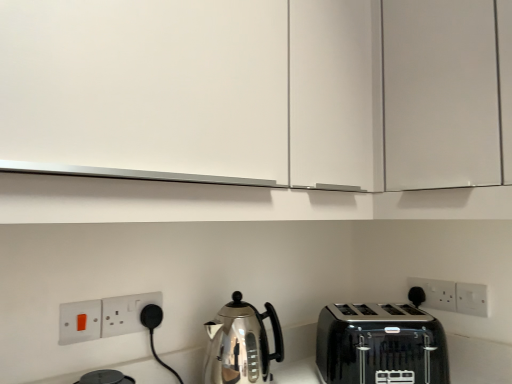
Question: Considering the positions of white matte cabinet at upper center and matte white switch at lower left, positioned as the first electric outlet in left-to-right order, in the image, is white matte cabinet at upper center bigger or smaller than matte white switch at lower left, positioned as the first electric outlet in left-to-right order,?

Choices:
 (A) big
 (B) small

Answer: (A)

Question: Would you say white matte cabinet at upper center is to the left or to the right of matte white switch at lower left, positioned as the first electric outlet in left-to-right order, in the picture?

Choices:
 (A) right
 (B) left

Answer: (A)

Question: Based on their relative distances, which object is nearer to the black glossy toaster at lower right?

Choices:
 (A) white plastic electrical outlet at lower right, the first electric outlet when ordered from back to front
 (B) matte white switch at lower left, marked as the first electric outlet in a front-to-back arrangement
 (C) white plastic electric outlet at right, which is counted as the first electric outlet, starting from the right
 (D) white matte cabinet at upper center
 (E) polished stainless steel kettle at center

Answer: (A)

Question: Which object is the farthest from the white matte cabinet at upper center?

Choices:
 (A) polished stainless steel kettle at center
 (B) white plastic electric outlet at right, which is counted as the first electric outlet, starting from the right
 (C) black glossy toaster at lower right
 (D) white plastic electrical outlet at lower right, the third electric outlet positioned from the left
 (E) matte white switch at lower left, which is the fourth electric outlet from back to front

Answer: (B)